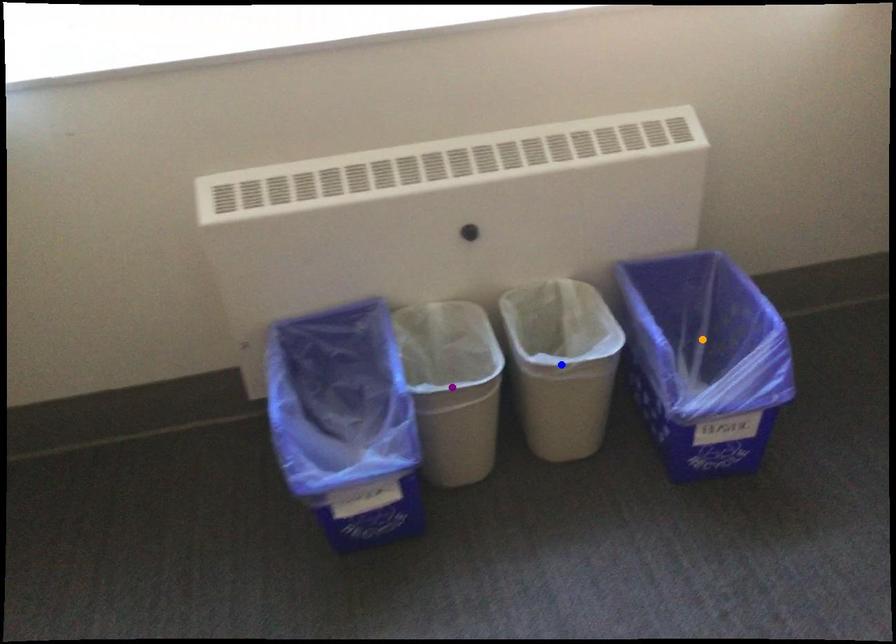
Order these from nearest to farthest:
- blue point
- orange point
- purple point

blue point
purple point
orange point